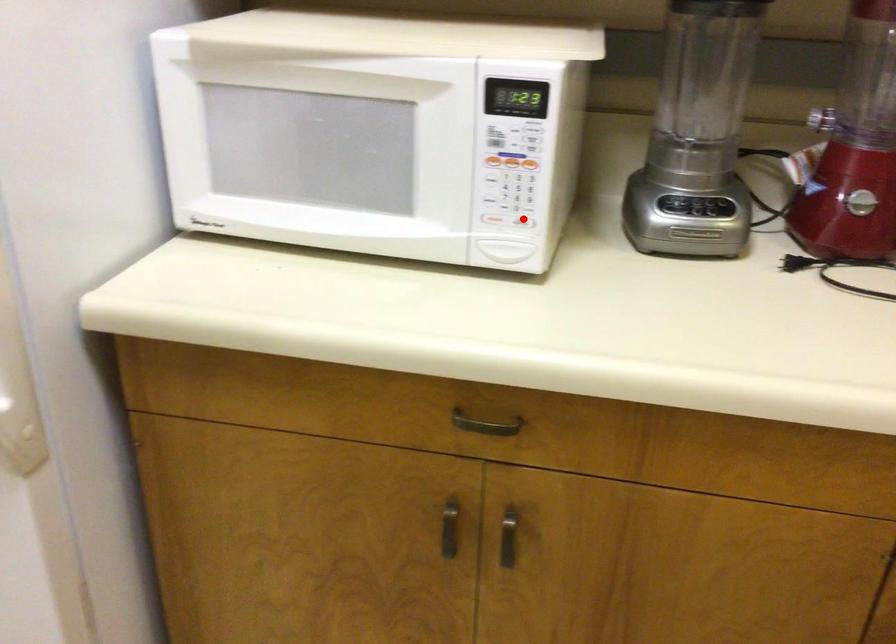
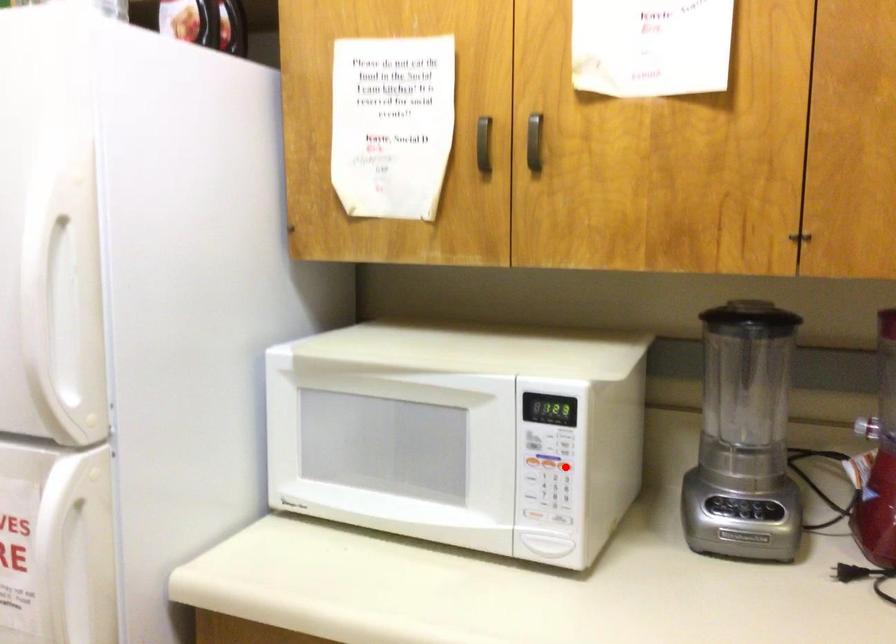
I am providing you with two images of the same scene from different viewpoints. A red point is marked on the first image and another point is marked on the second image. Is the marked point in image1 the same physical position as the marked point in image2?

No